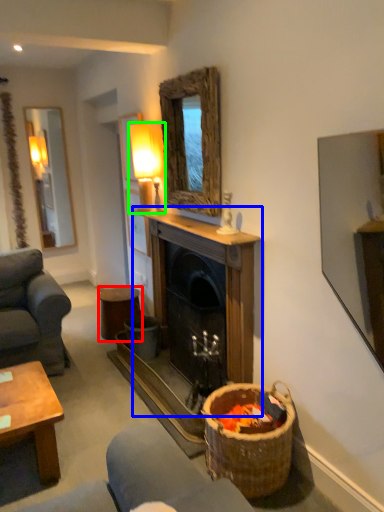
Question: Which object is positioned farthest from stool (highlighted by a red box)? Select from fireplace (highlighted by a blue box) and lamp (highlighted by a green box).

Choices:
 (A) fireplace
 (B) lamp

Answer: (B)